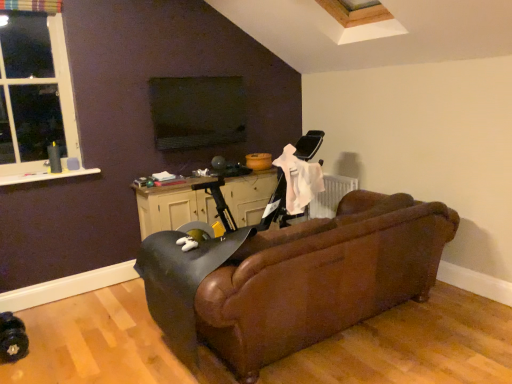
I want to click on black matte table at center, so click(x=173, y=206).

What do you see at coordinates (173, 206) in the screenshot? The image size is (512, 384). I see `black matte table at center` at bounding box center [173, 206].

Locate an element on the screen. Image resolution: width=512 pixels, height=384 pixels. leather swivel chair at center is located at coordinates (182, 280).

Find the location of `black matte table at center`. black matte table at center is located at coordinates (173, 206).

Can you confirm if white plastic window at upper left is positioned to the right of brown leather couch at center?

No.

From a real-world perspective, who is located lower, white plastic window at upper left or brown leather couch at center?

From a 3D spatial view, brown leather couch at center is below.

How different are the orientations of white plastic window at upper left and brown leather couch at center in degrees?

The angular difference between white plastic window at upper left and brown leather couch at center is 180 degrees.

Can you confirm if brown leather couch at center is smaller than leather swivel chair at center?

Incorrect, brown leather couch at center is not smaller in size than leather swivel chair at center.

From the image's perspective, which object appears higher, brown leather couch at center or leather swivel chair at center?

brown leather couch at center, from the image's perspective.

Considering the relative sizes of brown leather couch at center and leather swivel chair at center in the image provided, is brown leather couch at center wider than leather swivel chair at center?

Yes, brown leather couch at center is wider than leather swivel chair at center.

Is brown leather couch at center not near leather swivel chair at center?

No, there isn't a large distance between brown leather couch at center and leather swivel chair at center.

How different are the orientations of leather swivel chair at center and brown leather couch at center in degrees?

leather swivel chair at center and brown leather couch at center are facing 9.31e-05 degrees away from each other.

Based on the photo, is leather swivel chair at center outside of brown leather couch at center?

No, leather swivel chair at center is inside or overlapping with brown leather couch at center.

Between leather swivel chair at center and brown leather couch at center, which one has less height?

With less height is leather swivel chair at center.

Looking at this image, from a real-world perspective, between leather swivel chair at center and brown leather couch at center, who is vertically lower?

brown leather couch at center.

Is white plastic window at upper left directly adjacent to leather swivel chair at center?

No, white plastic window at upper left is not with leather swivel chair at center.

Between white plastic window at upper left and leather swivel chair at center, which one appears on the left side from the viewer's perspective?

white plastic window at upper left is more to the left.

Is black matte table at center oriented away from brown leather couch at center?

No, black matte table at center's orientation is not away from brown leather couch at center.

What's the angular difference between black matte table at center and brown leather couch at center's facing directions?

The angular difference between black matte table at center and brown leather couch at center is 179 degrees.

Does black matte table at center contain brown leather couch at center?

Actually, brown leather couch at center is outside black matte table at center.

From a real-world perspective, who is located lower, brown leather couch at center or white plastic window at upper left?

brown leather couch at center.

From the image's perspective, is brown leather couch at center on white plastic window at upper left?

No.

Considering the sizes of objects brown leather couch at center and white plastic window at upper left in the image provided, who is thinner, brown leather couch at center or white plastic window at upper left?

white plastic window at upper left is thinner.

Is point (230, 301) behind point (53, 96)?

No, it is in front of (53, 96).

From a real-world perspective, is leather swivel chair at center above or below black matte table at center?

In terms of real-world spatial position, leather swivel chair at center is below black matte table at center.

Who is shorter, leather swivel chair at center or black matte table at center?

Standing shorter between the two is black matte table at center.

Considering the sizes of objects leather swivel chair at center and black matte table at center in the image provided, who is thinner, leather swivel chair at center or black matte table at center?

black matte table at center.

Is leather swivel chair at center to the left of black matte table at center from the viewer's perspective?

No.

Find the location of a particular element. Image resolution: width=512 pixels, height=384 pixels. studio couch below the white plastic window at upper left (from a real-world perspective) is located at coordinates (x=293, y=279).

Find the location of a particular element. swivel chair lying on the left of brown leather couch at center is located at coordinates (182, 280).

Based on their spatial positions, is white plastic window at upper left or leather swivel chair at center further from black matte table at center?

white plastic window at upper left lies further to black matte table at center than the other object.

Looking at the image, which one is located further to leather swivel chair at center, black matte table at center or white plastic window at upper left?

white plastic window at upper left is further to leather swivel chair at center.

Considering their positions, is brown leather couch at center positioned closer to black matte table at center than white plastic window at upper left?

white plastic window at upper left is closer to black matte table at center.

Based on their spatial positions, is leather swivel chair at center or brown leather couch at center closer to white plastic window at upper left?

Among the two, leather swivel chair at center is located nearer to white plastic window at upper left.

Considering their positions, is leather swivel chair at center positioned further to brown leather couch at center than black matte table at center?

The object further to brown leather couch at center is black matte table at center.

Estimate the real-world distances between objects in this image. Which object is further from leather swivel chair at center, white plastic window at upper left or brown leather couch at center?

white plastic window at upper left.

Considering their positions, is black matte table at center positioned closer to brown leather couch at center than white plastic window at upper left?

Among the two, black matte table at center is located nearer to brown leather couch at center.

Based on their spatial positions, is black matte table at center or brown leather couch at center closer to leather swivel chair at center?

brown leather couch at center lies closer to leather swivel chair at center than the other object.

Where is `table between white plastic window at upper left and brown leather couch at center in the horizontal direction`? table between white plastic window at upper left and brown leather couch at center in the horizontal direction is located at coordinates (173, 206).

The width and height of the screenshot is (512, 384). Identify the location of swivel chair between white plastic window at upper left and brown leather couch at center in the horizontal direction. (182, 280).

Identify the location of swivel chair between brown leather couch at center and black matte table at center from front to back. This screenshot has height=384, width=512. (182, 280).

Where is `table between white plastic window at upper left and leather swivel chair at center from left to right`? The image size is (512, 384). table between white plastic window at upper left and leather swivel chair at center from left to right is located at coordinates (173, 206).